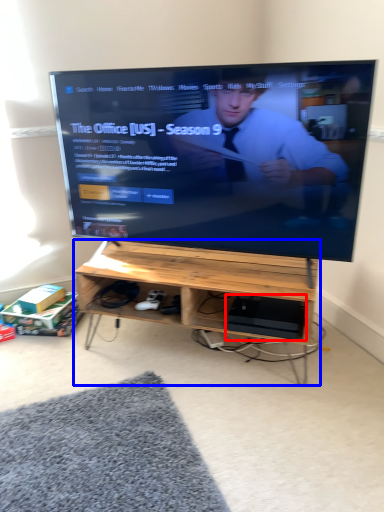
Question: Which object appears farthest to the camera in this image, computer (highlighted by a red box) or desk (highlighted by a blue box)?

Choices:
 (A) computer
 (B) desk

Answer: (A)